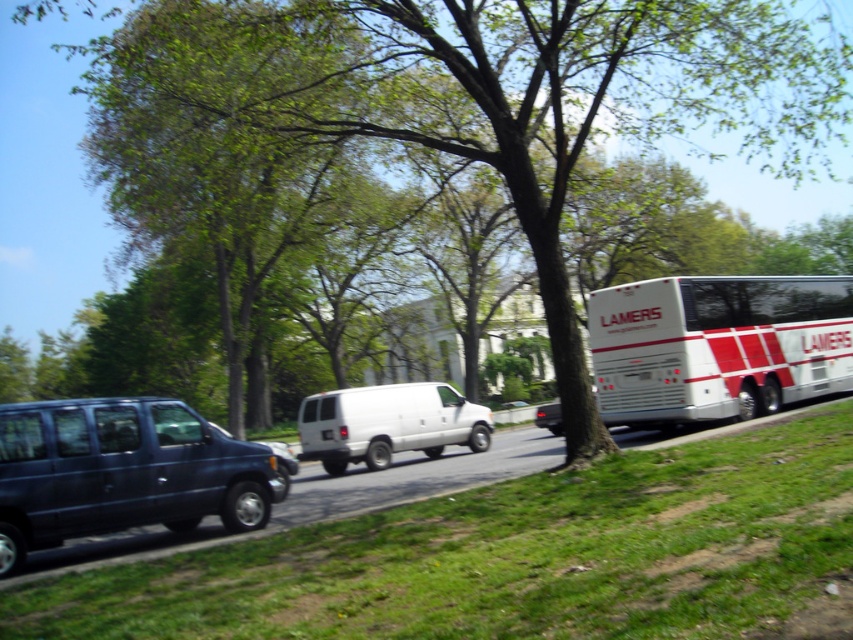
You are a pedestrian standing on the roadside verge. You see the green leafy tree at center and the matte black van at left. Which object is higher in the image?

The green leafy tree at center is above the matte black van at left, so the green leafy tree at center is higher in the image.

From the picture: You are standing at the point with coordinates (421, 166). What can you see there?

At point (421, 166), there is a green leafy tree at center.